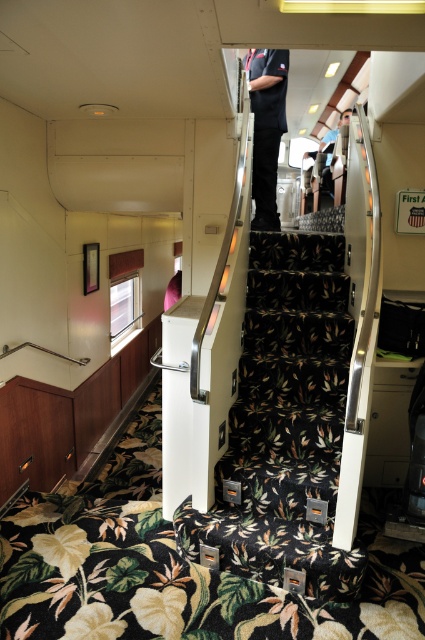
Question: Which point is closer to the camera?

Choices:
 (A) dark blue uniform at center
 (B) floral carpeted stairs at center

Answer: (B)

Question: Among these points, which one is farthest from the camera?

Choices:
 (A) (266, 97)
 (B) (269, 547)

Answer: (A)

Question: Is floral carpeted stairs at center bigger than dark blue uniform at center?

Choices:
 (A) yes
 (B) no

Answer: (A)

Question: Is floral carpeted stairs at center smaller than dark blue uniform at center?

Choices:
 (A) yes
 (B) no

Answer: (B)

Question: Among these objects, which one is farthest from the camera?

Choices:
 (A) dark blue uniform at center
 (B) floral carpeted stairs at center

Answer: (A)

Question: In this image, where is floral carpeted stairs at center located relative to dark blue uniform at center?

Choices:
 (A) left
 (B) right

Answer: (A)